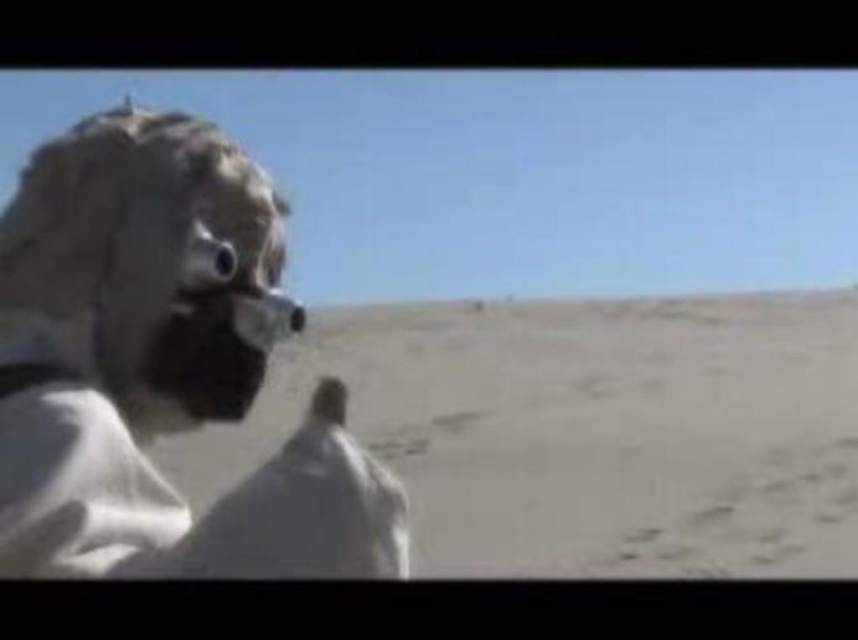
In the scene shown: Between smooth beige sand at center and white matte mask at left, which one is positioned lower?

smooth beige sand at center

The height and width of the screenshot is (640, 858). What do you see at coordinates (585, 432) in the screenshot?
I see `smooth beige sand at center` at bounding box center [585, 432].

Image resolution: width=858 pixels, height=640 pixels. I want to click on smooth beige sand at center, so click(585, 432).